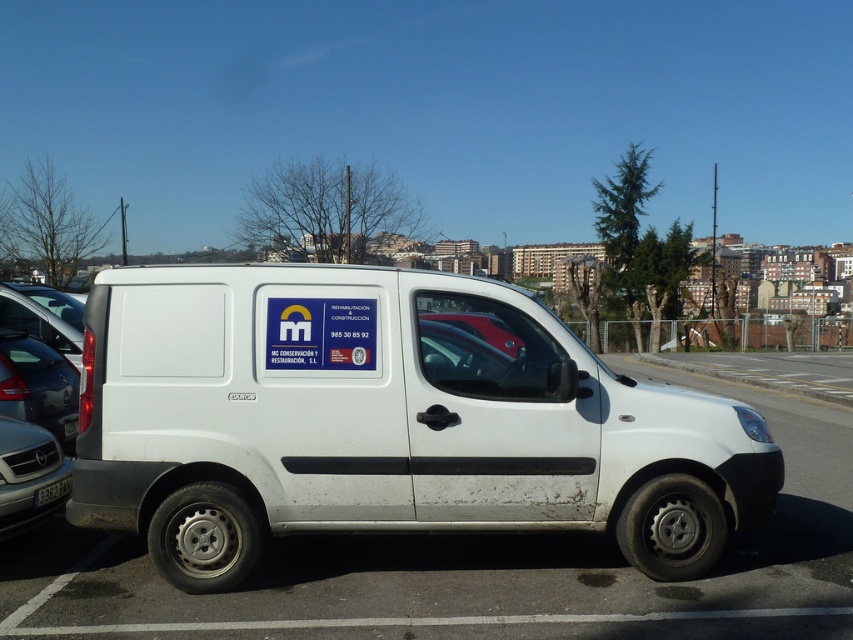
You are a delivery driver who needs to park your white matte van at center in a parking lot. There is a silver metallic car at lower left already parked. Can you park your van without overlapping any other vehicles?

The white matte van at center is positioned over silver metallic car at lower left, so you cannot park your van without overlapping the silver metallic car at lower left.

You are a delivery person trying to park your van in the parking lot. You need to align the van so that the point at (x=6, y=534) and the point at (x=38, y=499) are in a straight line. Which point should you position closer to the front of the parking spot?

Point at (x=6, y=534) should be positioned closer to the front of the parking spot because it is in front of point at (x=38, y=499).